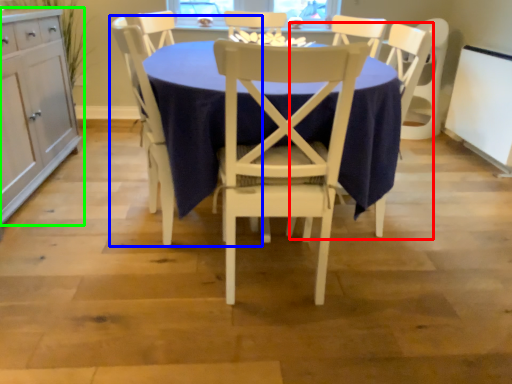
Question: Based on their relative distances, which object is farther from armchair (highlighted by a red box)? Choose from chair (highlighted by a blue box) and cabinetry (highlighted by a green box).

Choices:
 (A) chair
 (B) cabinetry

Answer: (B)